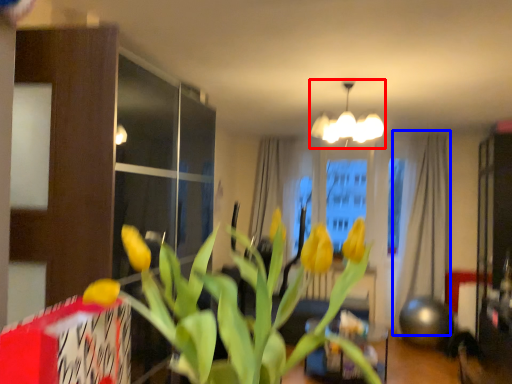
Question: Which object appears closest to the camera in this image, lamp (highlighted by a red box) or curtain (highlighted by a blue box)?

Choices:
 (A) lamp
 (B) curtain

Answer: (A)